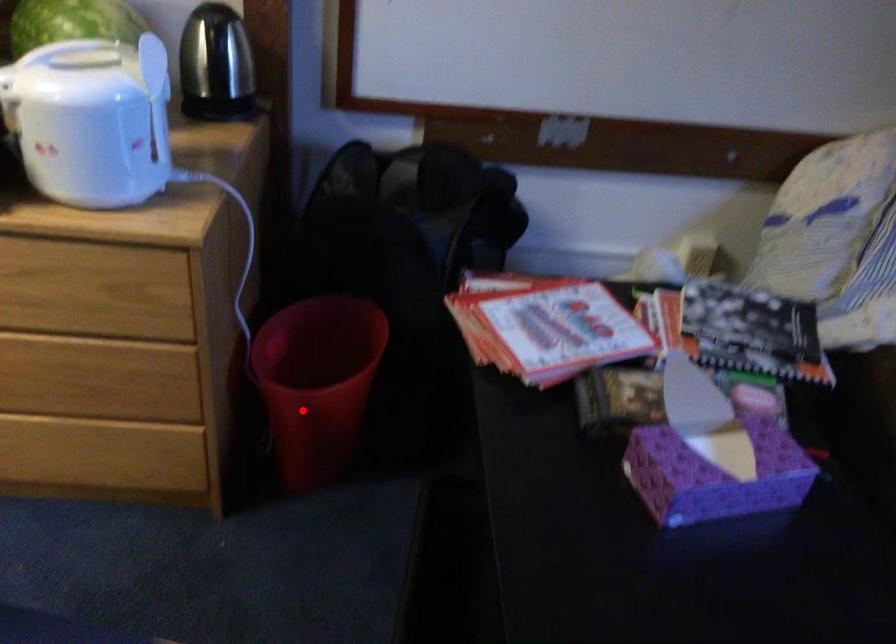
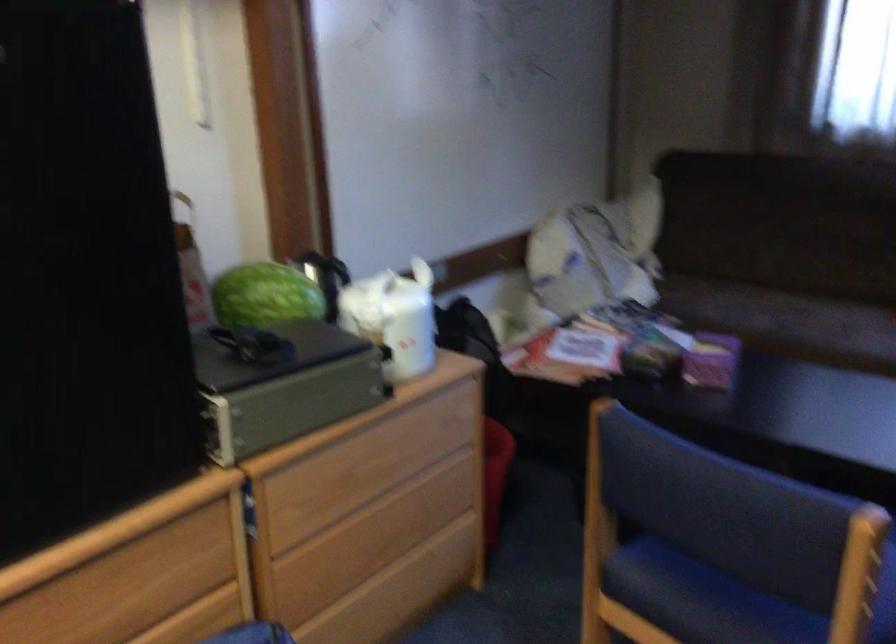
Where in the second image is the point corresponding to the highlighted location from the first image?

(495, 474)